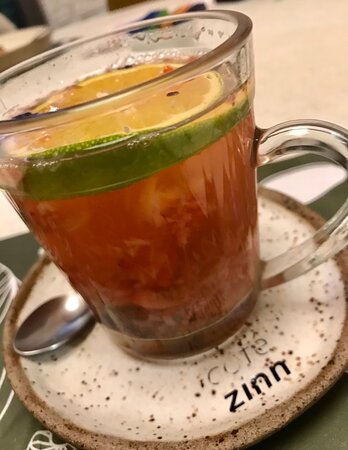
I want to click on brown edge plate, so click(x=275, y=414).